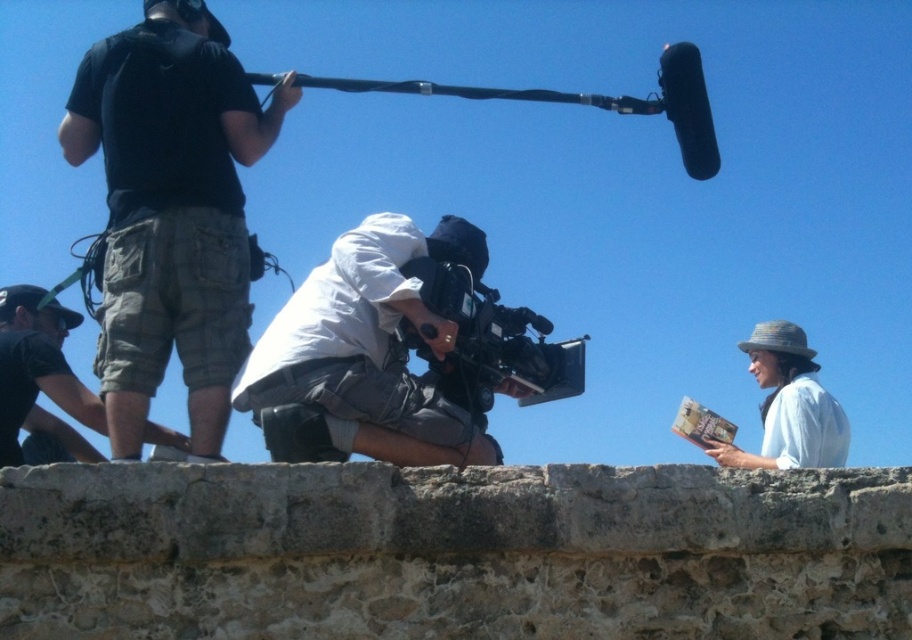
Question: Does white matte camera at center lie behind dark gray cargo shorts at left?

Choices:
 (A) no
 (B) yes

Answer: (A)

Question: Among these objects, which one is nearest to the camera?

Choices:
 (A) dark gray cargo shorts at left
 (B) white matte camera at center

Answer: (B)

Question: Which of these objects is positioned farthest from the black matte video camera at center?

Choices:
 (A) dark gray cargo shorts at left
 (B) white matte camera at center
 (C) white woven hat at right
 (D) black matte shirt at upper left

Answer: (C)

Question: Which point appears farthest from the camera in this image?

Choices:
 (A) (7, 412)
 (B) (123, 346)
 (C) (456, 310)

Answer: (A)

Question: Is black matte video camera at center below white woven hat at right?

Choices:
 (A) yes
 (B) no

Answer: (B)

Question: Is black matte shirt at upper left smaller than dark gray cargo shorts at left?

Choices:
 (A) yes
 (B) no

Answer: (B)